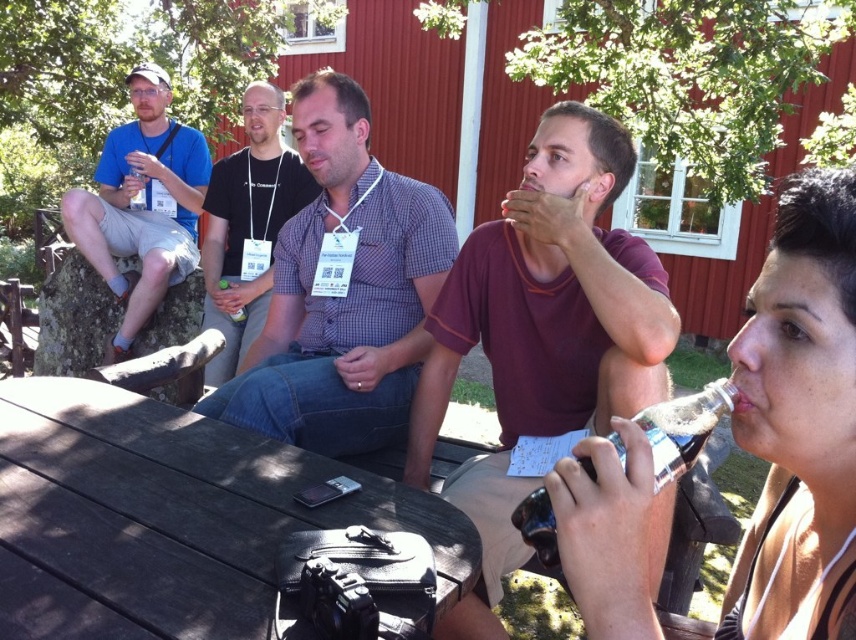
Question: Can you confirm if matte black shirt at center is positioned above clear plastic bottle at lower right?

Choices:
 (A) yes
 (B) no

Answer: (A)

Question: Estimate the real-world distances between objects in this image. Which object is farther from the matte black shirt at center?

Choices:
 (A) clear plastic bottle at lower right
 (B) matte blue shirt at left
 (C) brown wooden table at center

Answer: (A)

Question: Does maroon cotton shirt at center have a lesser width compared to matte blue shirt at left?

Choices:
 (A) no
 (B) yes

Answer: (B)

Question: Which object appears farthest from the camera in this image?

Choices:
 (A) checkered fabric shirt at center
 (B) maroon cotton shirt at center
 (C) clear plastic bottle at lower right

Answer: (A)

Question: Is brown wooden table at center above checkered fabric shirt at center?

Choices:
 (A) no
 (B) yes

Answer: (A)

Question: Based on their relative distances, which object is farther from the matte black shirt at center?

Choices:
 (A) maroon cotton shirt at center
 (B) brown wooden table at center

Answer: (A)